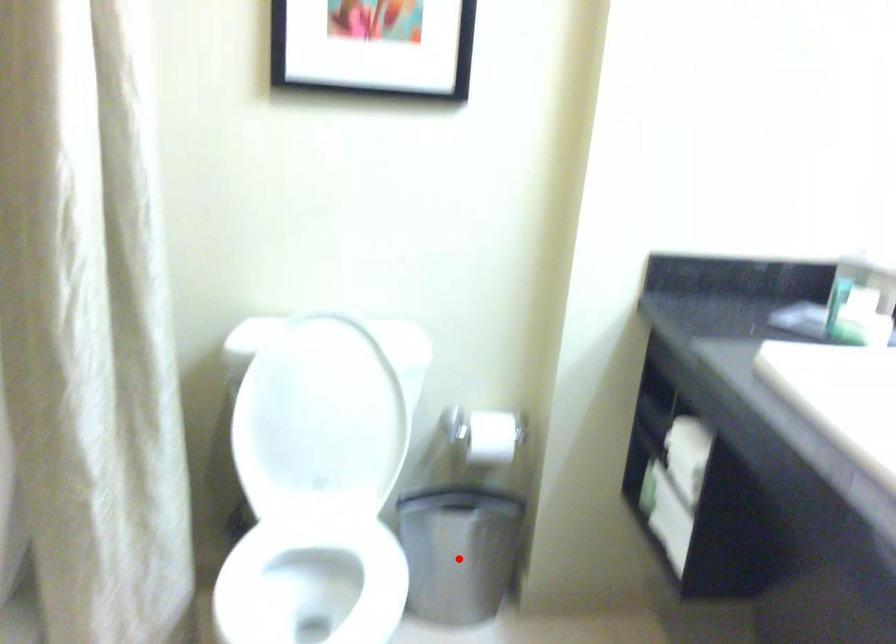
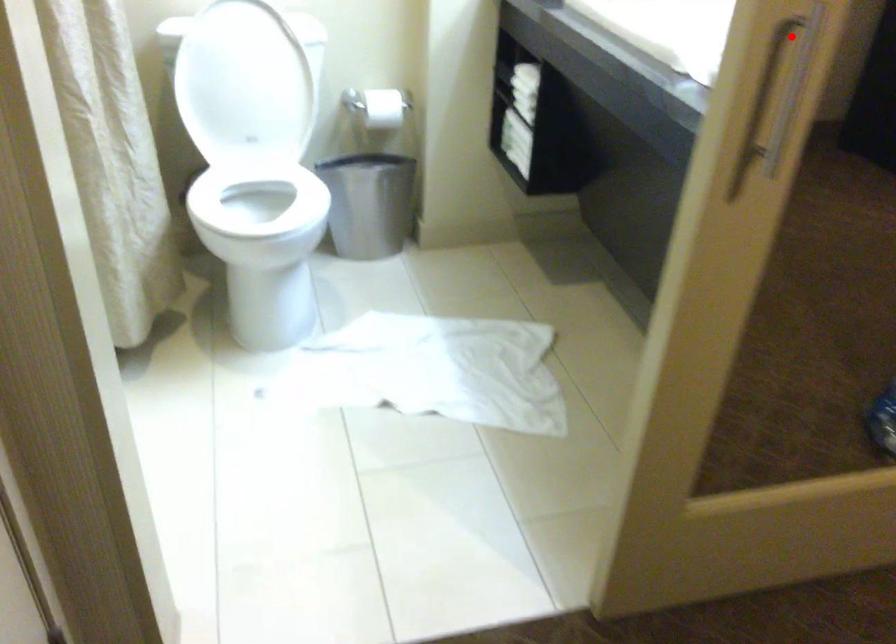
I am providing you with two images of the same scene from different viewpoints. A red point is marked on the first image and another point is marked on the second image. Is the marked point in image1 the same physical position as the marked point in image2?

No